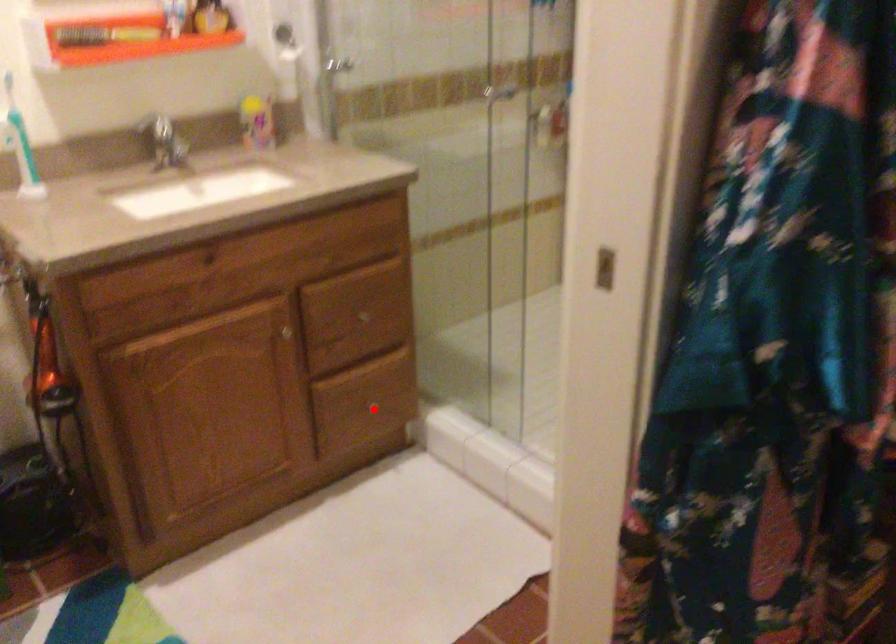
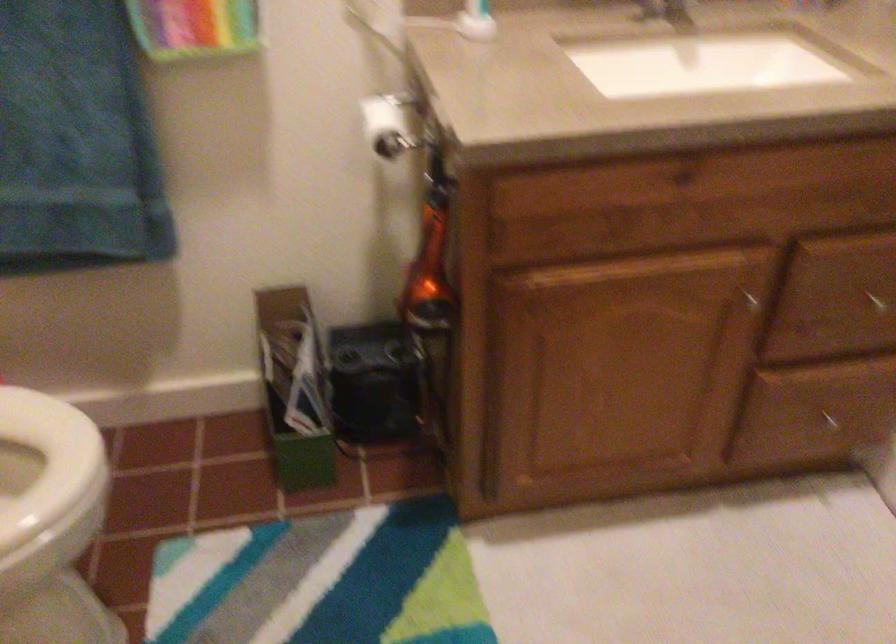
Question: I am providing you with two images of the same scene from different viewpoints. A red point is shown in image1. For the corresponding object point in image2, is it positioned nearer or farther from the camera?

Choices:
 (A) Nearer
 (B) Farther

Answer: (A)